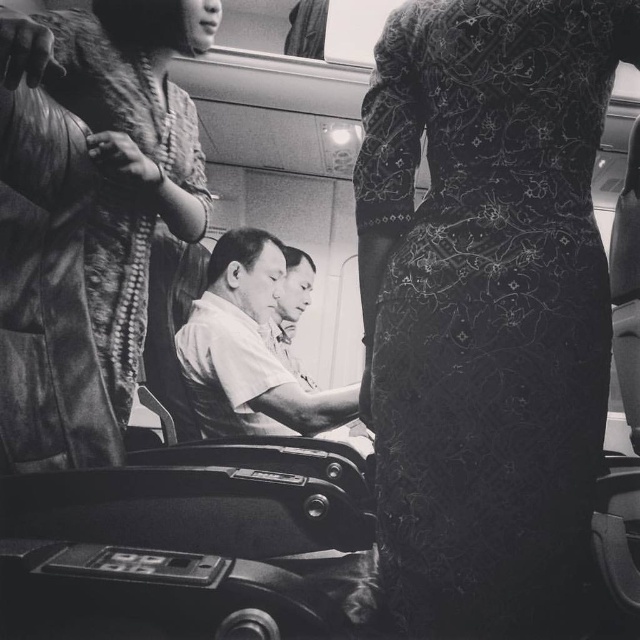
Question: Which point is farther from the camera taking this photo?

Choices:
 (A) (246, 250)
 (B) (307, 300)
 (C) (99, 291)
 (D) (417, 252)

Answer: (B)

Question: Observing the image, what is the correct spatial positioning of black lace dress at center in reference to smooth skin man at center?

Choices:
 (A) left
 (B) right

Answer: (B)

Question: Which object is the farthest from the smooth white shirt at center?

Choices:
 (A) smooth skin man at center
 (B) black lace dress at center
 (C) fur coat at upper left

Answer: (B)

Question: Can you confirm if fur coat at upper left is positioned below smooth skin man at center?

Choices:
 (A) no
 (B) yes

Answer: (A)

Question: Is black lace dress at center further to the viewer compared to smooth skin man at center?

Choices:
 (A) yes
 (B) no

Answer: (B)

Question: Which of the following is the closest to the observer?

Choices:
 (A) (304, 266)
 (B) (554, 314)

Answer: (B)